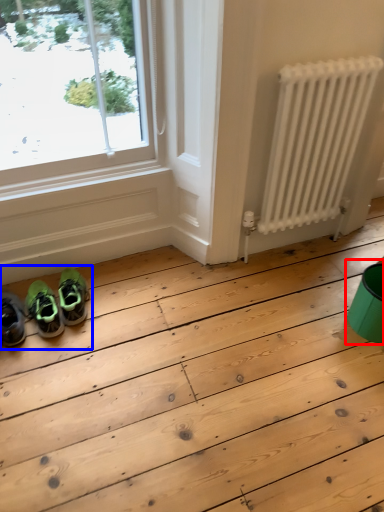
Question: Which point is further to the camera, teal (highlighted by a red box) or couple (highlighted by a blue box)?

Choices:
 (A) teal
 (B) couple

Answer: (B)